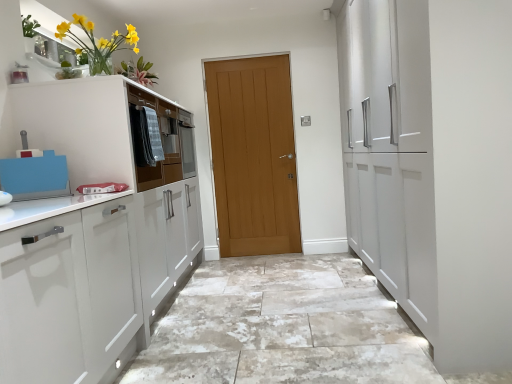
Question: Does light brown wooden door at center have a lesser height compared to marble-like granite floor at center?

Choices:
 (A) no
 (B) yes

Answer: (A)

Question: Considering the relative sizes of light brown wooden door at center and marble-like granite floor at center in the image provided, is light brown wooden door at center bigger than marble-like granite floor at center?

Choices:
 (A) yes
 (B) no

Answer: (B)

Question: From the image's perspective, is light brown wooden door at center under marble-like granite floor at center?

Choices:
 (A) no
 (B) yes

Answer: (A)

Question: Would you say light brown wooden door at center is a long distance from marble-like granite floor at center?

Choices:
 (A) no
 (B) yes

Answer: (B)

Question: Considering the relative sizes of light brown wooden door at center and marble-like granite floor at center in the image provided, is light brown wooden door at center thinner than marble-like granite floor at center?

Choices:
 (A) no
 (B) yes

Answer: (B)

Question: Considering the relative positions of light brown wooden door at center and marble-like granite floor at center in the image provided, is light brown wooden door at center to the left of marble-like granite floor at center from the viewer's perspective?

Choices:
 (A) no
 (B) yes

Answer: (B)

Question: Is matte brown drawer at center positioned behind yellow glass vase at upper left?

Choices:
 (A) yes
 (B) no

Answer: (A)

Question: From the image's perspective, is matte brown drawer at center located above yellow glass vase at upper left?

Choices:
 (A) no
 (B) yes

Answer: (A)

Question: Is matte brown drawer at center wider than yellow glass vase at upper left?

Choices:
 (A) yes
 (B) no

Answer: (B)

Question: Is matte brown drawer at center positioned far away from yellow glass vase at upper left?

Choices:
 (A) no
 (B) yes

Answer: (A)

Question: Does matte brown drawer at center appear on the right side of yellow glass vase at upper left?

Choices:
 (A) no
 (B) yes

Answer: (B)

Question: Does matte brown drawer at center have a lesser height compared to yellow glass vase at upper left?

Choices:
 (A) no
 (B) yes

Answer: (A)

Question: From the image's perspective, is marble-like granite floor at center located beneath light brown wooden door at center?

Choices:
 (A) no
 (B) yes

Answer: (B)